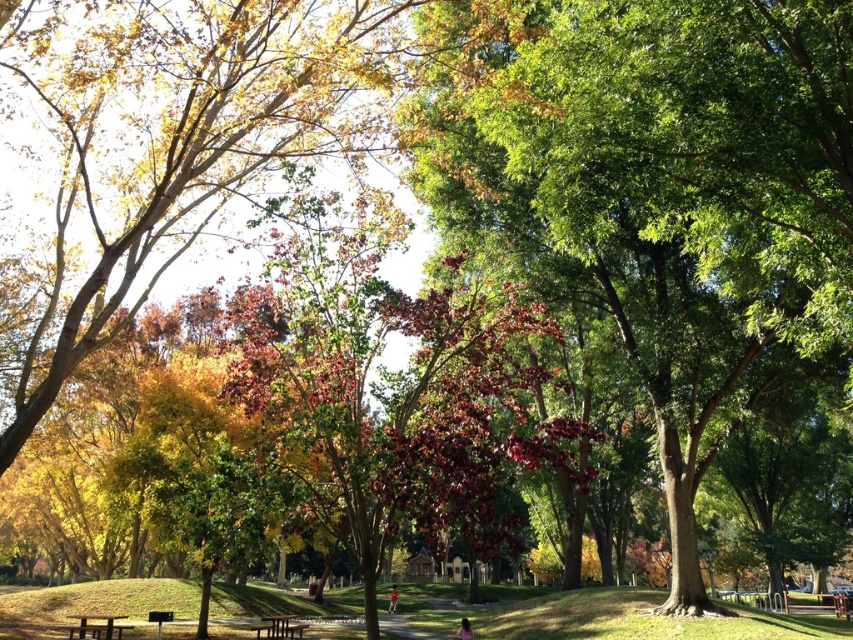
You are standing at the entrance of the park and see the pink fabric person at lower center and the red shirt at center walking along the path. Which one is closer to you?

The pink fabric person at lower center is closer to you because they are in front of the red shirt at center.

You are standing at the edge of the park path and see the green grass at lower center and the red shirt at center. Which object is closer to you?

The green grass at lower center is closer to you because it is in front of the red shirt at center.